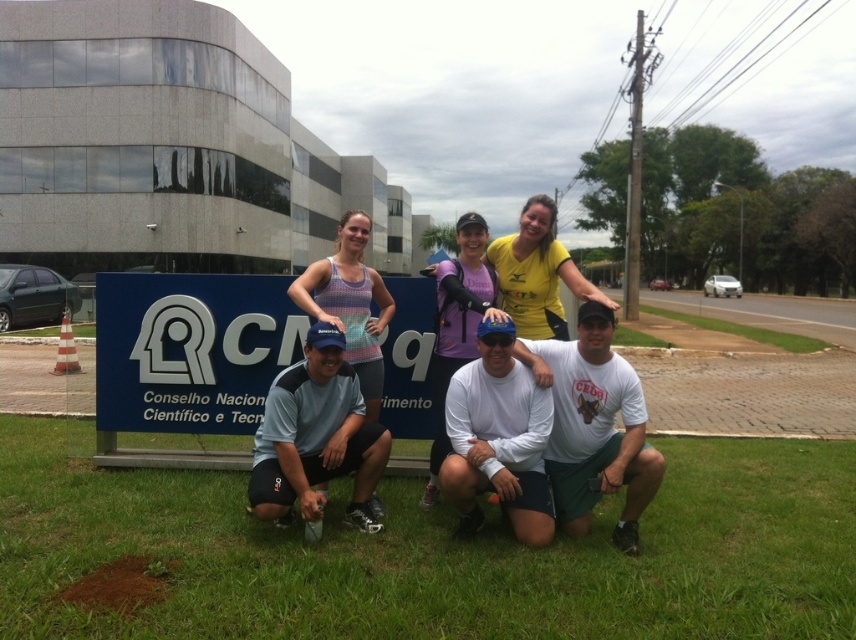
Is green grass at lower center to the right of blue fabric cap at center from the viewer's perspective?

Correct, you'll find green grass at lower center to the right of blue fabric cap at center.

Between point (639, 564) and point (269, 397), which one is positioned behind?

The point (269, 397) is more distant.

Between point (759, 609) and point (307, 493), which one is positioned behind?

The point (307, 493) is behind.

The image size is (856, 640). I want to click on green grass at lower center, so click(434, 554).